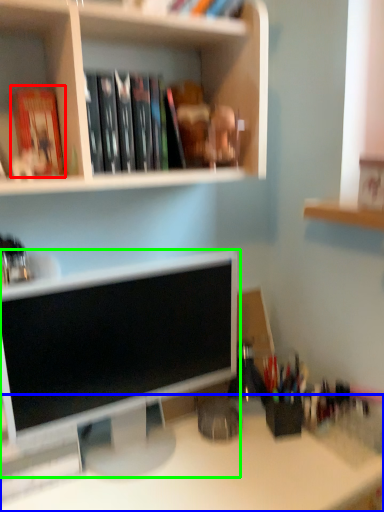
Question: Which object is positioned closest to paperback book (highlighted by a red box)? Select from desk (highlighted by a blue box) and computer monitor (highlighted by a green box).

Choices:
 (A) desk
 (B) computer monitor

Answer: (B)